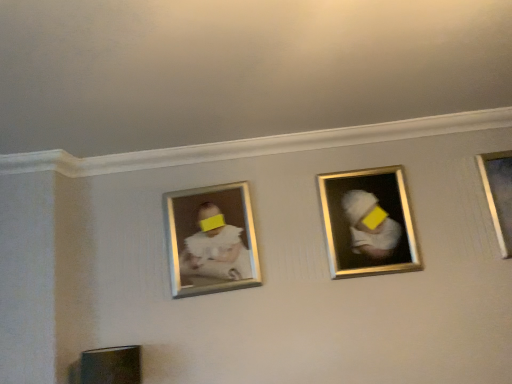
Question: Are white matte baby portrait at center and metallic silver picture frame at right, arranged as the second picture frame when viewed from the left, located far from each other?

Choices:
 (A) yes
 (B) no

Answer: (A)

Question: Considering the relative sizes of white matte baby portrait at center and metallic silver picture frame at right, arranged as the second picture frame when viewed from the left, in the image provided, is white matte baby portrait at center taller than metallic silver picture frame at right, arranged as the second picture frame when viewed from the left,?

Choices:
 (A) no
 (B) yes

Answer: (B)

Question: Does white matte baby portrait at center appear on the left side of metallic silver picture frame at right, arranged as the second picture frame when viewed from the left?

Choices:
 (A) no
 (B) yes

Answer: (B)

Question: Is white matte baby portrait at center not within metallic silver picture frame at right, arranged as the second picture frame when viewed from the left?

Choices:
 (A) no
 (B) yes

Answer: (B)

Question: From a real-world perspective, is white matte baby portrait at center beneath metallic silver picture frame at right, arranged as the second picture frame when viewed from the left?

Choices:
 (A) no
 (B) yes

Answer: (A)

Question: In terms of width, does metallic silver picture frame at right, positioned as the first picture frame in right-to-left order, look wider or thinner when compared to gold metallic picture frame at center, the 2th picture frame in the right-to-left sequence?

Choices:
 (A) thin
 (B) wide

Answer: (A)

Question: Considering the positions of metallic silver picture frame at right, arranged as the second picture frame when viewed from the left, and gold metallic picture frame at center, arranged as the 1th picture frame when viewed from the left, in the image, is metallic silver picture frame at right, arranged as the second picture frame when viewed from the left, bigger or smaller than gold metallic picture frame at center, arranged as the 1th picture frame when viewed from the left,?

Choices:
 (A) big
 (B) small

Answer: (B)

Question: Do you think metallic silver picture frame at right, arranged as the second picture frame when viewed from the left, is within gold metallic picture frame at center, arranged as the 1th picture frame when viewed from the left, or outside of it?

Choices:
 (A) outside
 (B) inside

Answer: (A)

Question: Is point (507, 203) closer or farther from the camera than point (327, 198)?

Choices:
 (A) closer
 (B) farther

Answer: (A)

Question: From a real-world perspective, is gold metallic picture frame at center, the 2th picture frame in the right-to-left sequence, positioned above or below white matte baby portrait at center?

Choices:
 (A) above
 (B) below

Answer: (B)

Question: From the image's perspective, is gold metallic picture frame at center, arranged as the 1th picture frame when viewed from the left, positioned above or below white matte baby portrait at center?

Choices:
 (A) below
 (B) above

Answer: (B)

Question: Considering the positions of gold metallic picture frame at center, the 2th picture frame in the right-to-left sequence, and white matte baby portrait at center in the image, is gold metallic picture frame at center, the 2th picture frame in the right-to-left sequence, bigger or smaller than white matte baby portrait at center?

Choices:
 (A) big
 (B) small

Answer: (A)

Question: From their relative heights in the image, would you say gold metallic picture frame at center, the 2th picture frame in the right-to-left sequence, is taller or shorter than white matte baby portrait at center?

Choices:
 (A) tall
 (B) short

Answer: (A)

Question: Looking at their shapes, would you say white matte baby portrait at center is wider or thinner than metallic silver picture frame at right, positioned as the first picture frame in right-to-left order?

Choices:
 (A) wide
 (B) thin

Answer: (A)

Question: From the image's perspective, is white matte baby portrait at center above or below metallic silver picture frame at right, positioned as the first picture frame in right-to-left order?

Choices:
 (A) below
 (B) above

Answer: (A)